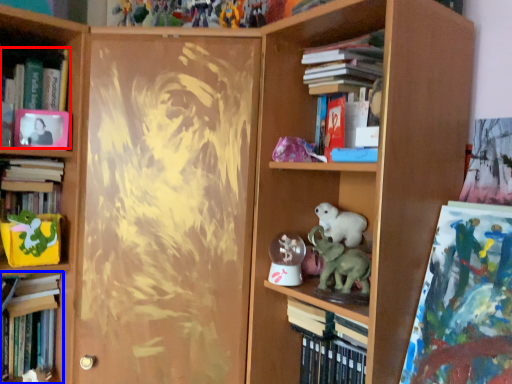
Question: Which object appears closest to the camera in this image, book (highlighted by a red box) or book (highlighted by a blue box)?

Choices:
 (A) book
 (B) book

Answer: (A)